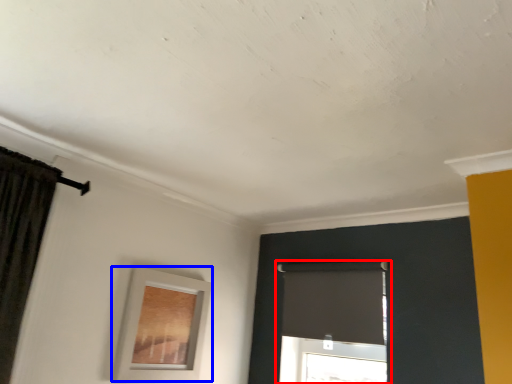
Question: Which object appears closest to the camera in this image, window (highlighted by a red box) or picture frame (highlighted by a blue box)?

Choices:
 (A) window
 (B) picture frame

Answer: (B)